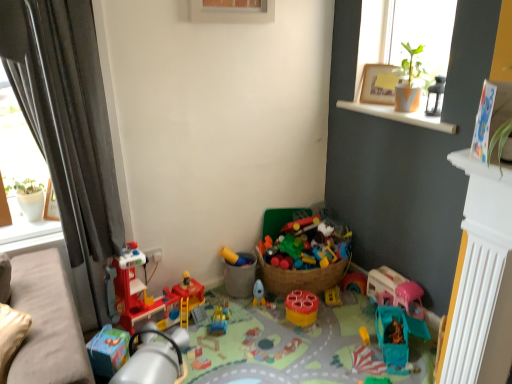
The width and height of the screenshot is (512, 384). I want to click on vacant area located to the right-hand side of matte plastic cup at center, the sixth toy from the left, so click(338, 313).